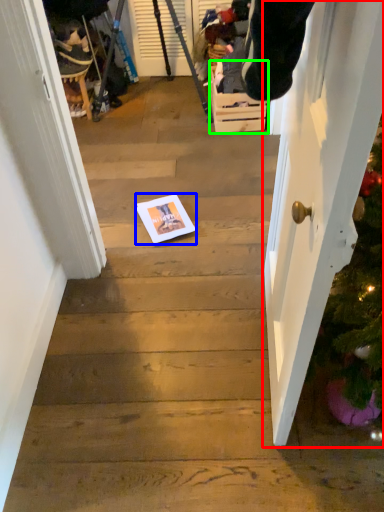
Question: Which is nearer to the door (highlighted by a red box)? copy (highlighted by a blue box) or drawer (highlighted by a green box).

Choices:
 (A) copy
 (B) drawer

Answer: (A)